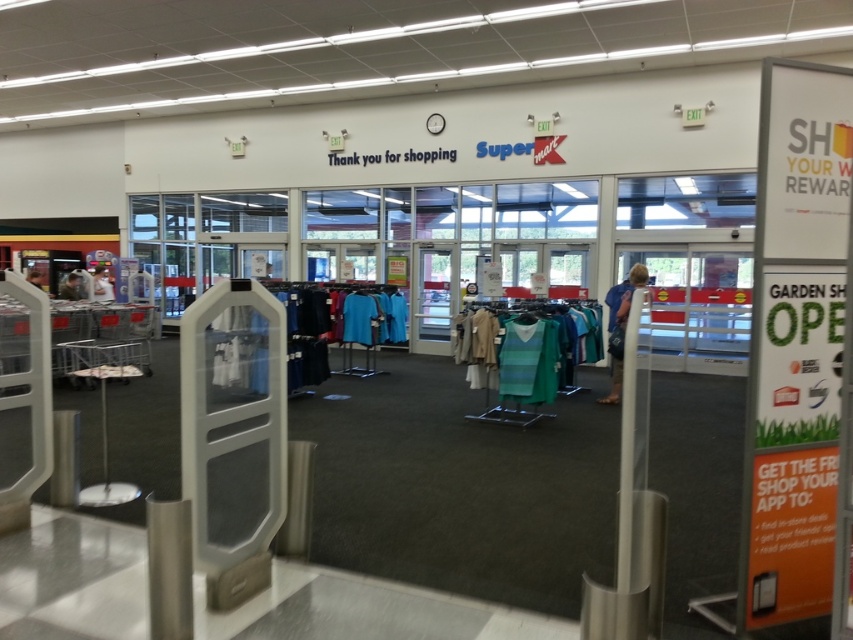
You are a customer holding a pair of blue denim jeans at center. You want to place them on the checkout counter which is located at the entrance. Can you walk straight towards the entrance without passing through the security gates?

The blue denim jeans at center is positioned at point (630, 296). Since the security gates are at the entrance, you would need to walk straight towards them to reach the checkout counter. However, the security gates are positioned at the entrance, so you would have to pass through them to exit, but placing the jeans on the checkout counter likely requires approaching the counter first, which is before the gates. Therefore, you can walk straight towards the entrance without passing through the security gat

You are a customer in the store and want to place both the blue denim jeans at center and the blue fabric dress at center into your shopping bag. Which item should you place first to ensure both fit properly?

You should place the blue denim jeans at center first because it is larger in size than the blue fabric dress at center. Placing the larger item first allows smaller items to fill in the remaining space, maximizing the bag capacity.